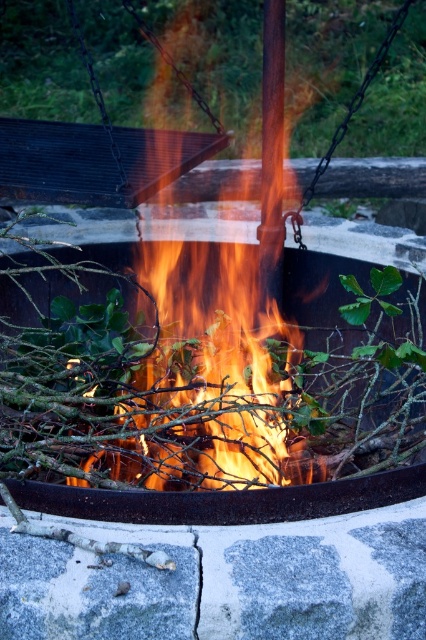
You are standing near the fire pit and want to add more wood to the flames. Which object should you place closer to the flames to ensure it catches fire quickly? The flamewoodenfire at center or the flaming wood at center?

The flaming wood at center is already burning, so you should place new wood closer to the flamewoodenfire at center to ensure it catches fire quickly.